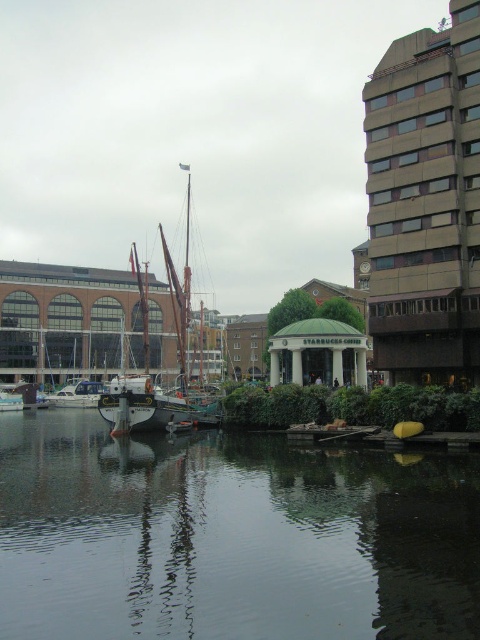
You are standing on the dock and see the smooth dark water at center and the wooden sailboat at center. Which one is located to the right side of the other?

The smooth dark water at center is positioned on the right side of wooden sailboat at center.

You are standing at the waterfront and want to take a photo of the two points marked in the scene. Which point, point (351,433) or point (98,392), will appear larger in your camera view?

Point (351,433) will appear larger because it is closer to the camera than point (98,392).

You are standing at the point with coordinates point [201,355] and want to walk to the point [208,552]. Which direction should you face to walk towards your destination?

You should face the direction towards the waterfront where the boat named HALIBON is docked because point [208,552] is in front of point [201,355], indicating it is closer to the waterfront.